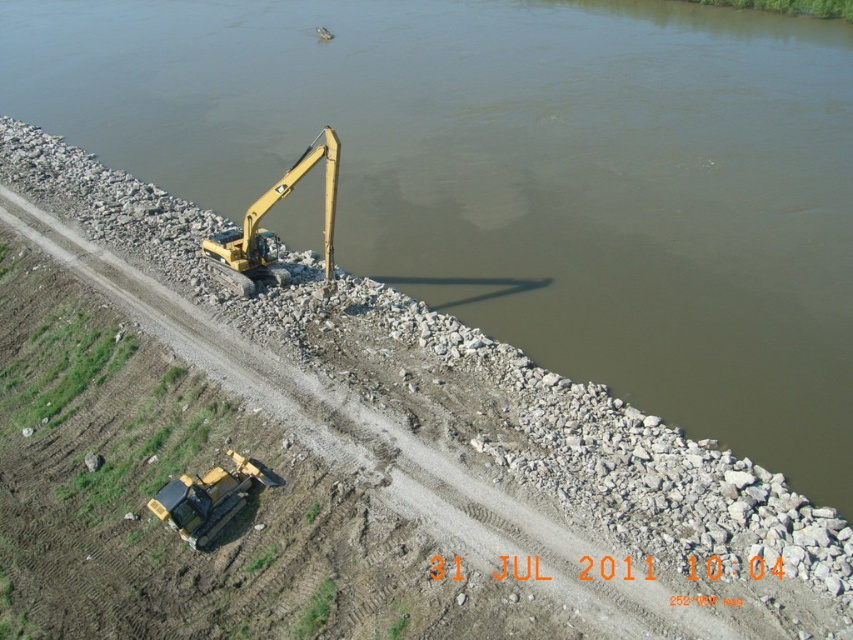
Does yellow metallic excavator at center have a lesser height compared to yellow rubber tractor at lower left?

No, yellow metallic excavator at center is not shorter than yellow rubber tractor at lower left.

Which is behind, point (328, 136) or point (167, 483)?

The point (328, 136) is more distant.

Image resolution: width=853 pixels, height=640 pixels. What are the coordinates of `yellow metallic excavator at center` in the screenshot? It's located at (270, 230).